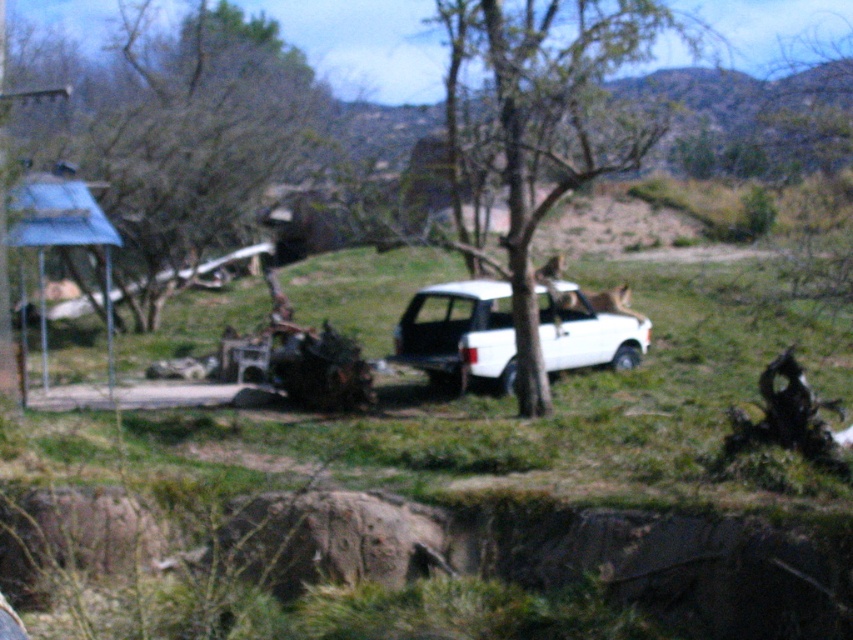
Question: Is brown bark tree at center positioned before white matte suv at center?

Choices:
 (A) no
 (B) yes

Answer: (B)

Question: Which point appears farthest from the camera in this image?

Choices:
 (A) (639, 116)
 (B) (508, 385)

Answer: (A)

Question: Which point is farther from the camera taking this photo?

Choices:
 (A) (419, 296)
 (B) (567, 184)

Answer: (A)

Question: Is brown bark tree at center closer to the viewer compared to white matte suv at center?

Choices:
 (A) yes
 (B) no

Answer: (A)

Question: Does brown bark tree at center have a smaller size compared to white matte suv at center?

Choices:
 (A) no
 (B) yes

Answer: (B)